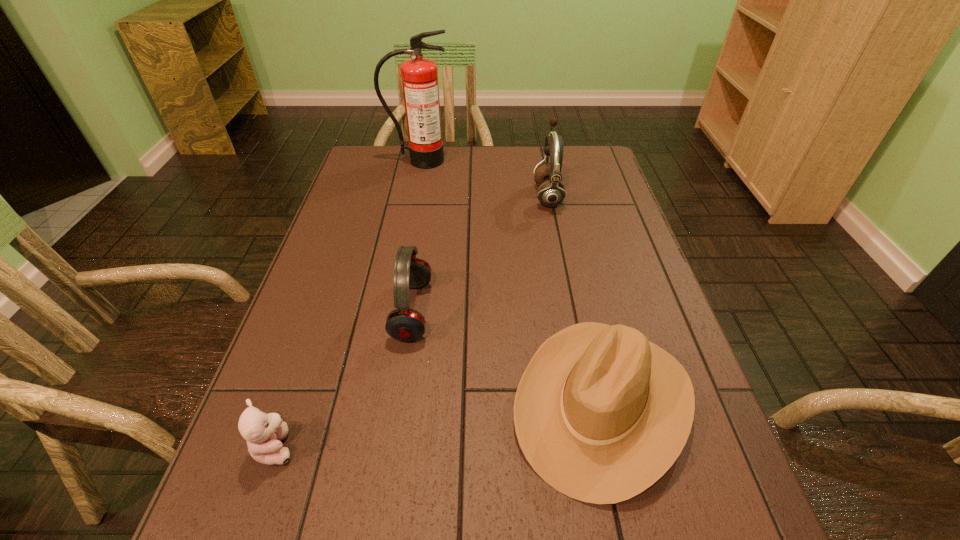
Find the location of `object located at the right edge`. object located at the right edge is located at coordinates (601, 413).

Locate an element on the screen. object present at the far left corner is located at coordinates (419, 75).

This screenshot has width=960, height=540. Find the location of `vacant space at the far edge of the desktop`. vacant space at the far edge of the desktop is located at coordinates (456, 150).

I want to click on vacant area at the left edge of the desktop, so click(x=382, y=228).

I want to click on vacant point at the right edge, so click(645, 256).

The width and height of the screenshot is (960, 540). In the image, there is a desktop. In order to click on vacant space at the far left corner in this screenshot , I will do `click(364, 148)`.

Where is `vacant region at the far right corner of the desktop`? vacant region at the far right corner of the desktop is located at coordinates (578, 168).

Where is `free spot between the fourth tallest object and the fire extinguisher`? free spot between the fourth tallest object and the fire extinguisher is located at coordinates (511, 281).

This screenshot has height=540, width=960. Find the location of `free space that is in between the fire extinguisher and the right earphone`. free space that is in between the fire extinguisher and the right earphone is located at coordinates (483, 178).

Find the location of `unoccupied position between the fire extinguisher and the shortest object`. unoccupied position between the fire extinguisher and the shortest object is located at coordinates (348, 303).